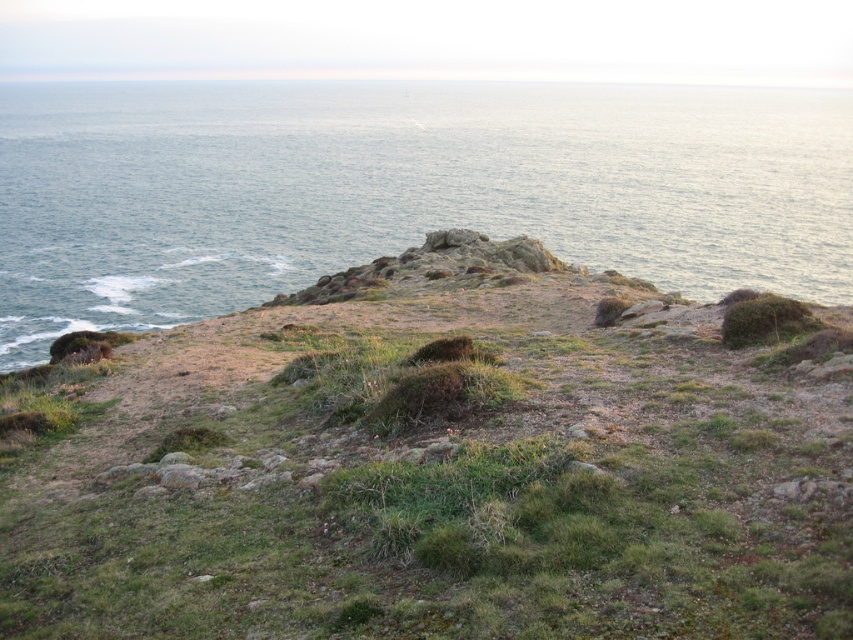
Does green grassy hillside at center have a greater width compared to blue water at upper center?

No.

Is green grassy hillside at center above blue water at upper center?

No, green grassy hillside at center is not above blue water at upper center.

Identify the location of green grassy hillside at center. The image size is (853, 640). (436, 465).